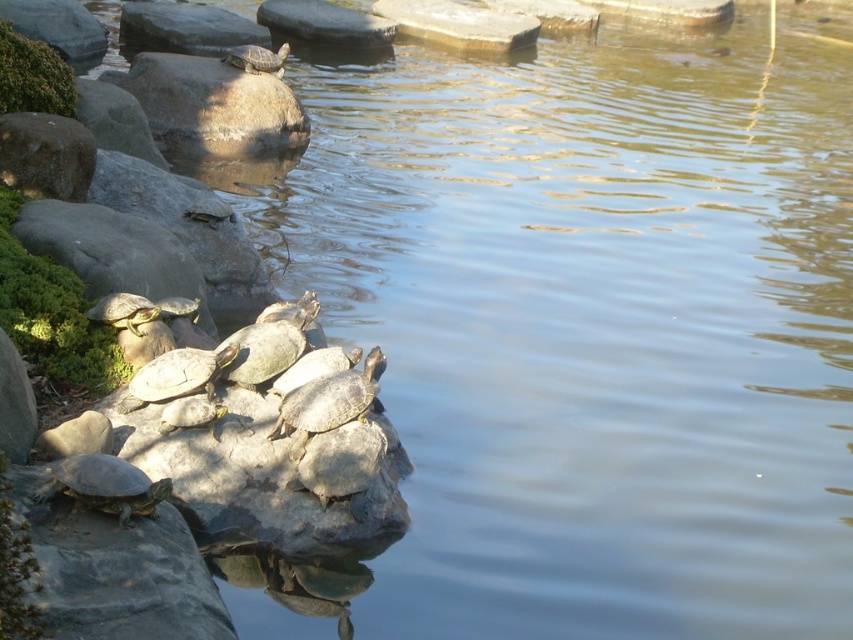
Question: Is brown rough rock at upper center bigger than shiny green tortoise at center left?

Choices:
 (A) yes
 (B) no

Answer: (A)

Question: Which point is farther to the camera?

Choices:
 (A) (287, 420)
 (B) (195, 384)
 (C) (161, 120)

Answer: (C)

Question: Among these objects, which one is farthest from the camera?

Choices:
 (A) brown rough rock at upper center
 (B) shiny brown tortoise at center

Answer: (A)

Question: Is shiny brown tortoise at lower left smaller than smooth brown tortoise at upper center?

Choices:
 (A) no
 (B) yes

Answer: (B)

Question: Does brown rough rock at upper center appear on the right side of shiny green tortoise at center left?

Choices:
 (A) no
 (B) yes

Answer: (A)

Question: Which point appears closest to the camera in this image?

Choices:
 (A) (257, 64)
 (B) (364, 368)
 (C) (131, 400)
 (D) (134, 298)

Answer: (C)